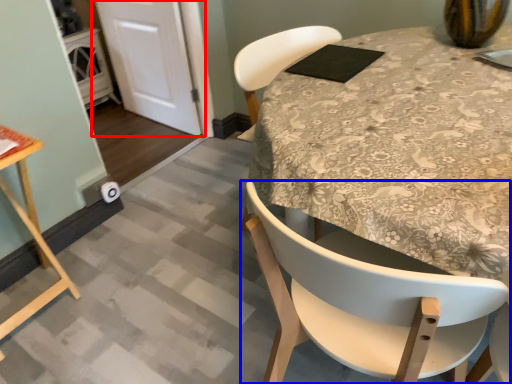
Question: Which object appears closest to the camera in this image, door (highlighted by a red box) or chair (highlighted by a blue box)?

Choices:
 (A) door
 (B) chair

Answer: (B)